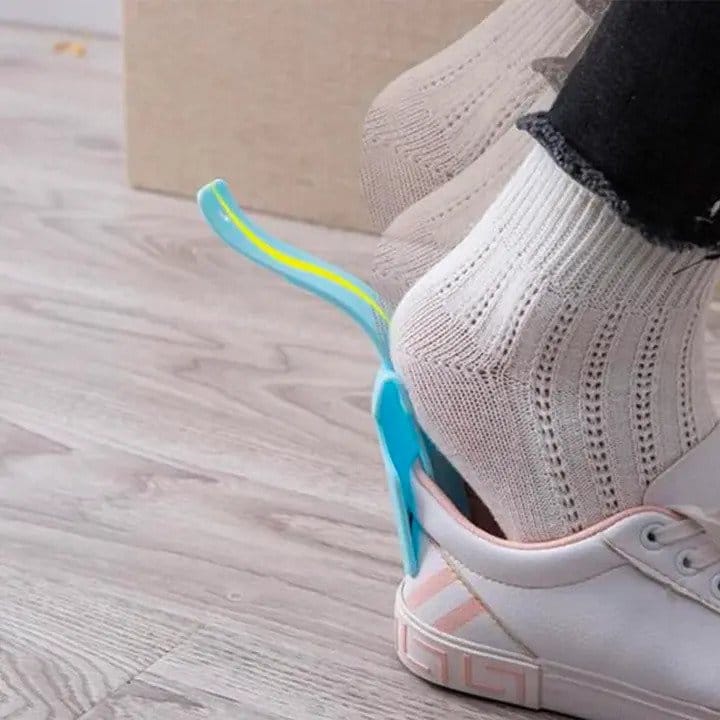
Image resolution: width=720 pixels, height=720 pixels. Find the location of `left sock`. left sock is located at coordinates (474, 89).